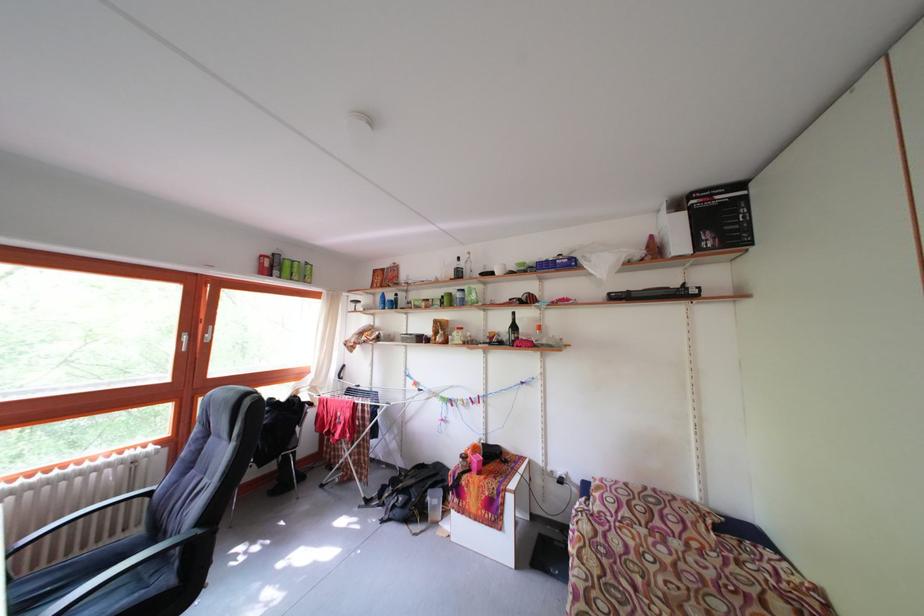
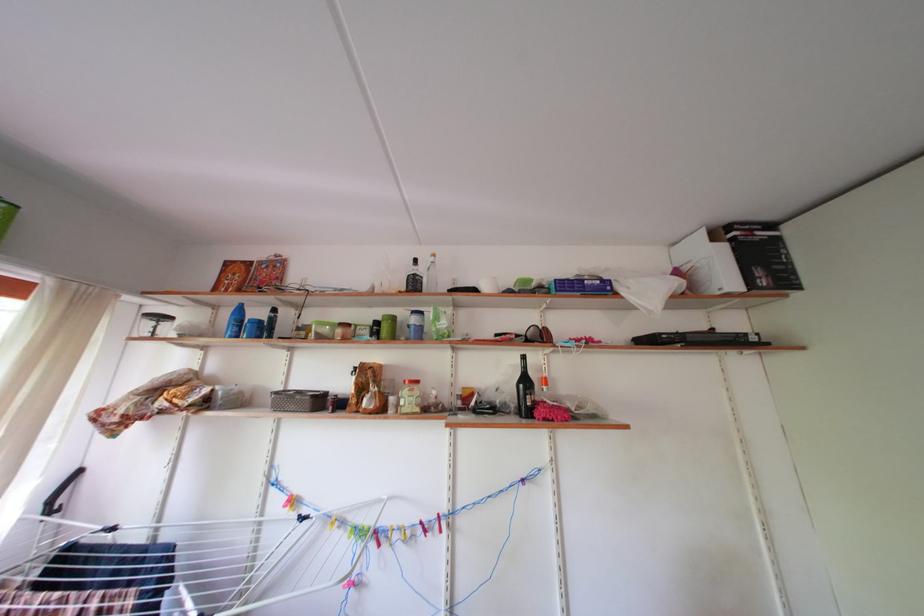
Locate, in the second image, the point that corresponds to point 713,243 in the first image.

(768, 278)